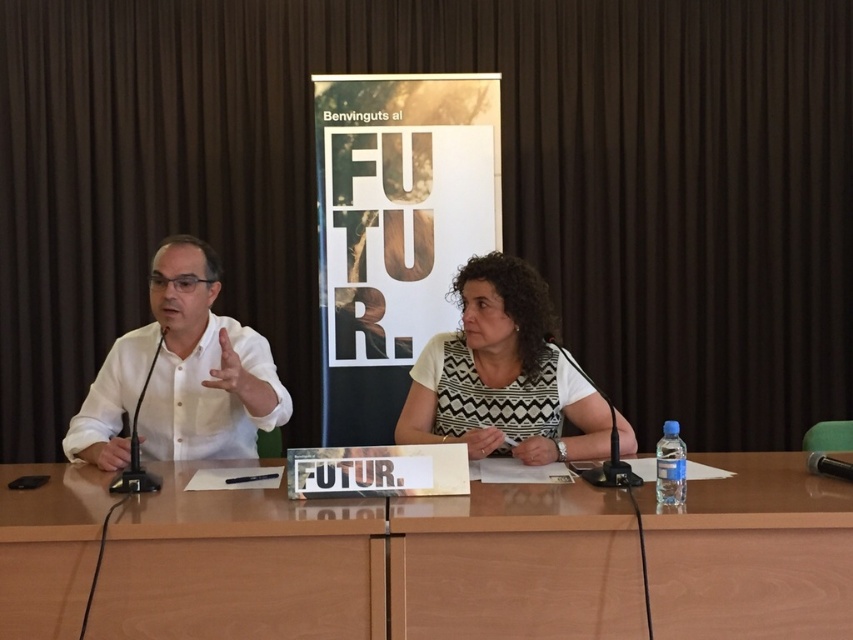
You are a photographer setting up for a photo shoot at this scene. You need to ensure that the wooden table at center is visible in the frame without being blocked by the white dotted dress at center. Based on their sizes, will the dress block the table?

The wooden table at center is shorter than the white dotted dress at center, so the dress will block the table in the frame.

You are a photographer standing at the back of the room. You need to capture a closeup shot of the wooden table at center and the white dotted dress at center. Given that your camera can focus on objects within a 40 cm range, will you be able to get a clear photo of both subjects?

The wooden table at center is 41.07 centimeters away from white dotted dress at center. Since the distance between them exceeds the camera focus range of 40 cm, you cannot capture both subjects in a single clear closeup photo.